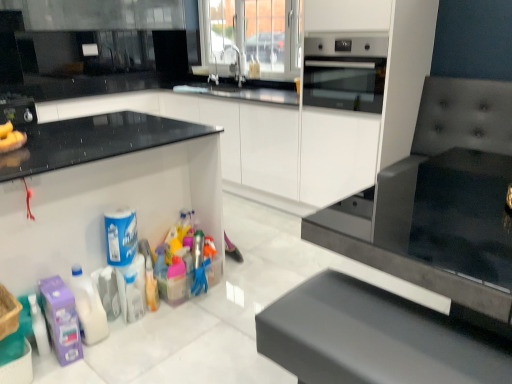
What do you see at coordinates (102, 189) in the screenshot? I see `white plastic container at lower left, the 2th cabinetry positioned from the back` at bounding box center [102, 189].

In order to face silver metallic faucet at upper center, which is the 2th faucet from right to left, should I rotate leftwards or rightwards?

You should look left and rotate roughly 5.849 degrees.

What is the approximate height of white glossy cabinet at center, which ranks as the first cabinetry in back-to-front order?

It is 35.74 inches.

You are a GUI agent. You are given a task and a screenshot of the screen. Output one action in this format:
    pyautogui.click(x=<x>, y=<y>)
    Task: Click on the transparent glass door at upper center
    The height and width of the screenshot is (384, 512).
    Given the screenshot: What is the action you would take?
    pyautogui.click(x=251, y=37)

In terms of height, does transparent glass door at upper center look taller or shorter compared to purple matte cleaning product at lower left, which is the 4th cleaning product from right to left?

transparent glass door at upper center is taller than purple matte cleaning product at lower left, which is the 4th cleaning product from right to left.

Is transparent glass door at upper center beside purple matte cleaning product at lower left, which is the 4th cleaning product from right to left?

Answer: No, transparent glass door at upper center is not beside purple matte cleaning product at lower left, which is the 4th cleaning product from right to left.

Where is `cleaning product that is the 4th object to the left of the transparent glass door at upper center, starting at the anchor`? The width and height of the screenshot is (512, 384). cleaning product that is the 4th object to the left of the transparent glass door at upper center, starting at the anchor is located at coordinates (61, 319).

In terms of width, does transparent glass door at upper center look wider or thinner when compared to purple matte cleaning product at lower left, which is the 4th cleaning product from right to left?

transparent glass door at upper center is thinner than purple matte cleaning product at lower left, which is the 4th cleaning product from right to left.

Based on the photo, which object is further away from the camera, white glossy bottle at lower left, which is the third cleaning product from right to left, or blue plastic canister at lower left, which is the 3th cleaning product from left to right?

blue plastic canister at lower left, which is the 3th cleaning product from left to right, is behind.

Looking at their sizes, would you say white glossy bottle at lower left, which is the third cleaning product from right to left, is wider or thinner than blue plastic canister at lower left, which is the 3th cleaning product from left to right?

white glossy bottle at lower left, which is the third cleaning product from right to left, is wider than blue plastic canister at lower left, which is the 3th cleaning product from left to right.

From the blue plastic canister at lower left, which appears as the second cleaning product when viewed from the right, count the 1st cleaning product to the left and point to it. Please provide its 2D coordinates.

[(88, 307)]

From a real-world perspective, is white glossy bottle at lower left, marked as the 2th cleaning product in a left-to-right arrangement, physically above blue plastic canister at lower left, which appears as the second cleaning product when viewed from the right?

No.

Is blue plastic canister at lower left, which is the 3th cleaning product from left to right, taller than brushed metal toaster at left?

Indeed, blue plastic canister at lower left, which is the 3th cleaning product from left to right, has a greater height compared to brushed metal toaster at left.

Is blue plastic canister at lower left, which appears as the second cleaning product when viewed from the right, touching brushed metal toaster at left?

No, blue plastic canister at lower left, which appears as the second cleaning product when viewed from the right, is not making contact with brushed metal toaster at left.

Considering the sizes of objects blue plastic canister at lower left, which appears as the second cleaning product when viewed from the right, and brushed metal toaster at left in the image provided, who is smaller, blue plastic canister at lower left, which appears as the second cleaning product when viewed from the right, or brushed metal toaster at left?

blue plastic canister at lower left, which appears as the second cleaning product when viewed from the right.

Is blue plastic canister at lower left, which appears as the second cleaning product when viewed from the right, to the left of brushed metal toaster at left from the viewer's perspective?

No.

How many degrees apart are the facing directions of blue plastic canister at lower left, which appears as the second cleaning product when viewed from the right, and silver metallic faucet at upper center, which is the 2th faucet from left to right?

They differ by 88.4 degrees in their facing directions.

How much distance is there between blue plastic canister at lower left, which appears as the second cleaning product when viewed from the right, and silver metallic faucet at upper center, marked as the first faucet in a right-to-left arrangement?

blue plastic canister at lower left, which appears as the second cleaning product when viewed from the right, is 7.67 feet from silver metallic faucet at upper center, marked as the first faucet in a right-to-left arrangement.

Is point (125, 243) closer or farther from the camera than point (238, 57)?

Point (125, 243) appears to be closer to the viewer than point (238, 57).

Is blue plastic canister at lower left, which is the 3th cleaning product from left to right, oriented away from silver metallic faucet at upper center, marked as the first faucet in a right-to-left arrangement?

No, blue plastic canister at lower left, which is the 3th cleaning product from left to right, is not facing the opposite direction of silver metallic faucet at upper center, marked as the first faucet in a right-to-left arrangement.

How many degrees apart are the facing directions of white glossy cabinet at center, which ranks as the first cabinetry in back-to-front order, and silver metallic faucet at upper center, which is the 2th faucet from left to right?

1.29 degrees separate the facing orientations of white glossy cabinet at center, which ranks as the first cabinetry in back-to-front order, and silver metallic faucet at upper center, which is the 2th faucet from left to right.

Does white glossy cabinet at center, which is the 2th cabinetry in front-to-back order, appear on the left side of silver metallic faucet at upper center, marked as the first faucet in a right-to-left arrangement?

Correct, you'll find white glossy cabinet at center, which is the 2th cabinetry in front-to-back order, to the left of silver metallic faucet at upper center, marked as the first faucet in a right-to-left arrangement.

Is silver metallic faucet at upper center, which is the 2th faucet from left to right, located within white glossy cabinet at center, which ranks as the first cabinetry in back-to-front order?

No, silver metallic faucet at upper center, which is the 2th faucet from left to right, is not inside white glossy cabinet at center, which ranks as the first cabinetry in back-to-front order.

Considering the sizes of objects white glossy cabinet at center, which ranks as the first cabinetry in back-to-front order, and silver metallic faucet at upper center, marked as the first faucet in a right-to-left arrangement, in the image provided, who is taller, white glossy cabinet at center, which ranks as the first cabinetry in back-to-front order, or silver metallic faucet at upper center, marked as the first faucet in a right-to-left arrangement,?

white glossy cabinet at center, which ranks as the first cabinetry in back-to-front order.

Considering the sizes of objects translucent plastic container at center, the 4th cleaning product positioned from the left, and purple matte cleaning product at lower left, which appears as the first cleaning product when viewed from the left, in the image provided, who is taller, translucent plastic container at center, the 4th cleaning product positioned from the left, or purple matte cleaning product at lower left, which appears as the first cleaning product when viewed from the left,?

Standing taller between the two is purple matte cleaning product at lower left, which appears as the first cleaning product when viewed from the left.

Can you confirm if translucent plastic container at center, the 4th cleaning product positioned from the left, is positioned to the right of purple matte cleaning product at lower left, which is the 4th cleaning product from right to left?

Yes, translucent plastic container at center, the 4th cleaning product positioned from the left, is to the right of purple matte cleaning product at lower left, which is the 4th cleaning product from right to left.

From a real-world perspective, who is located higher, translucent plastic container at center, the first cleaning product viewed from the right, or purple matte cleaning product at lower left, which appears as the first cleaning product when viewed from the left?

From a 3D spatial view, translucent plastic container at center, the first cleaning product viewed from the right, is above.

What are the coordinates of `the 1st faucet positioned below the transparent glass door at upper center (from the image's perspective)` in the screenshot? It's located at (214, 75).

From a real-world perspective, is silver metallic faucet at upper center, the first faucet in the left-to-right sequence, located beneath transparent glass door at upper center?

Yes, from a real-world perspective, silver metallic faucet at upper center, the first faucet in the left-to-right sequence, is beneath transparent glass door at upper center.

From the image's perspective, between silver metallic faucet at upper center, which is the 2th faucet from right to left, and transparent glass door at upper center, which one is located above?

transparent glass door at upper center.

Is silver metallic faucet at upper center, the first faucet in the left-to-right sequence, taller or shorter than transparent glass door at upper center?

Clearly, silver metallic faucet at upper center, the first faucet in the left-to-right sequence, is shorter compared to transparent glass door at upper center.

There is a transparent glass door at upper center. In order to click on the 4th cleaning product below it (from a real-world perspective) in this screenshot , I will do `click(61, 319)`.

From the white glossy bottle at lower left, marked as the 2th cleaning product in a left-to-right arrangement, count 1st cleaning product to the right and point to it. Please provide its 2D coordinates.

[(121, 236)]

Considering their positions, is black leather cushion at lower center positioned further to blue plastic canister at lower left, which appears as the second cleaning product when viewed from the right, than white plastic container at lower left, marked as the first cabinetry in a front-to-back arrangement?

Among the two, black leather cushion at lower center is located further to blue plastic canister at lower left, which appears as the second cleaning product when viewed from the right.

When comparing their distances from translucent plastic container at center, the 4th cleaning product positioned from the left, does silver metallic faucet at upper center, which is the 2th faucet from left to right, or transparent glass door at upper center seem further?

transparent glass door at upper center is further to translucent plastic container at center, the 4th cleaning product positioned from the left.

Based on their spatial positions, is black leather cushion at lower center or purple matte cleaning product at lower left, which appears as the first cleaning product when viewed from the left, further from white plastic container at lower left, marked as the first cabinetry in a front-to-back arrangement?

black leather cushion at lower center is positioned further to the anchor white plastic container at lower left, marked as the first cabinetry in a front-to-back arrangement.

From the image, which object appears to be farther from silver metallic faucet at upper center, which is the 2th faucet from left to right, white plastic container at lower left, the 2th cabinetry positioned from the back, or black leather cushion at lower center?

Among the two, black leather cushion at lower center is located further to silver metallic faucet at upper center, which is the 2th faucet from left to right.

Looking at the image, which one is located further to silver metallic faucet at upper center, which is the 2th faucet from left to right, stainless steel oven at upper right or silver metallic faucet at upper center, which is the 2th faucet from right to left?

The object further to silver metallic faucet at upper center, which is the 2th faucet from left to right, is stainless steel oven at upper right.

Looking at the image, which one is located further to white glossy cabinet at center, which is the 2th cabinetry in front-to-back order, white plastic container at lower left, marked as the first cabinetry in a front-to-back arrangement, or translucent plastic container at center, the 4th cleaning product positioned from the left?

Based on the image, translucent plastic container at center, the 4th cleaning product positioned from the left, appears to be further to white glossy cabinet at center, which is the 2th cabinetry in front-to-back order.

Looking at the image, which one is located closer to translucent plastic container at center, the 4th cleaning product positioned from the left, brushed metal toaster at left or white glossy cabinet at center, which is the 2th cabinetry in front-to-back order?

Based on the image, white glossy cabinet at center, which is the 2th cabinetry in front-to-back order, appears to be nearer to translucent plastic container at center, the 4th cleaning product positioned from the left.

Based on the photo, looking at the image, which one is located closer to silver metallic faucet at upper center, which is the 2th faucet from right to left, transparent glass door at upper center or brushed metal toaster at left?

transparent glass door at upper center is positioned closer to the anchor silver metallic faucet at upper center, which is the 2th faucet from right to left.

Find the location of a particular element. The height and width of the screenshot is (384, 512). bottle between white plastic container at lower left, marked as the first cabinetry in a front-to-back arrangement, and brushed metal toaster at left, along the z-axis is located at coordinates (133, 297).

Where is `faucet between brushed metal toaster at left and silver metallic faucet at upper center, which is the 2th faucet from left to right, from left to right`? The width and height of the screenshot is (512, 384). faucet between brushed metal toaster at left and silver metallic faucet at upper center, which is the 2th faucet from left to right, from left to right is located at coordinates (214, 75).

Where is `bottle between brushed metal toaster at left and stainless steel oven at upper right from left to right`? bottle between brushed metal toaster at left and stainless steel oven at upper right from left to right is located at coordinates (133, 297).

Identify the location of bottle between white glossy bottle at lower left, marked as the 2th cleaning product in a left-to-right arrangement, and translucent plastic container at center, the first cleaning product viewed from the right, in the horizontal direction. The width and height of the screenshot is (512, 384). (133, 297).